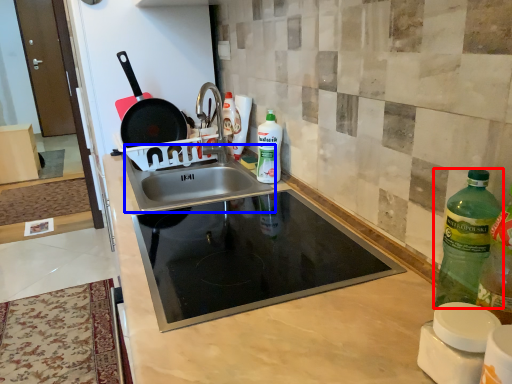
Question: Which object appears farthest to the camera in this image, bottle (highlighted by a red box) or sink (highlighted by a blue box)?

Choices:
 (A) bottle
 (B) sink

Answer: (B)